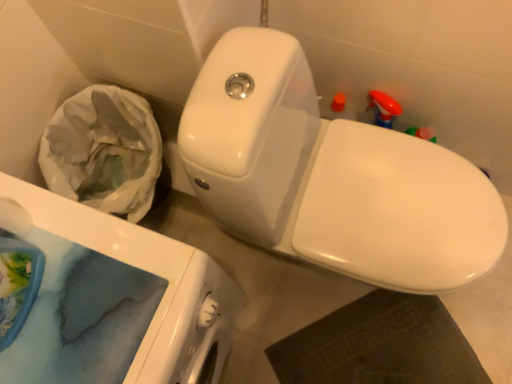
Where is `empty space that is to the right of white matte toilet paper at lower left`? empty space that is to the right of white matte toilet paper at lower left is located at coordinates (104, 241).